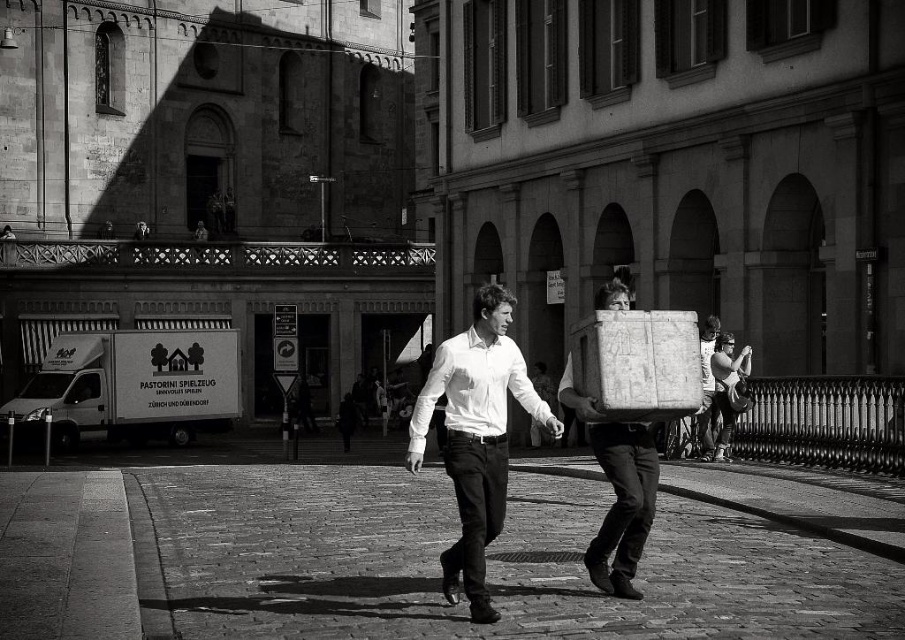
Looking at this image, you are standing on the cobblestone plaza and want to hand a small note to the person wearing the white smooth shirt at center without disturbing the person carrying the smooth cardboard box at center. Which person should you approach first based on their proximity to you?

You should approach the person wearing the white smooth shirt at center first because they are closer to you than the smooth cardboard box at center, which is further away.